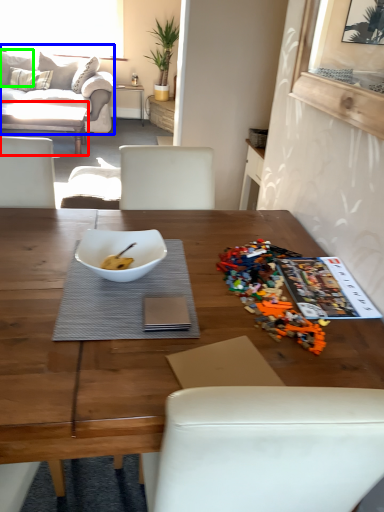
Question: Which object is the closest to the coffee table (highlighted by a red box)? Choose among these: studio couch (highlighted by a blue box) or pillow (highlighted by a green box).

Choices:
 (A) studio couch
 (B) pillow

Answer: (A)